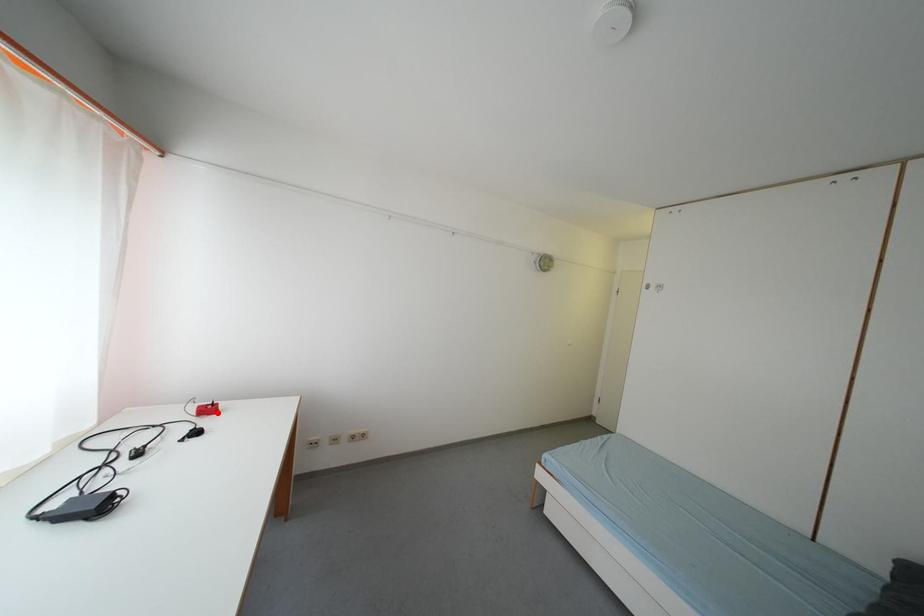
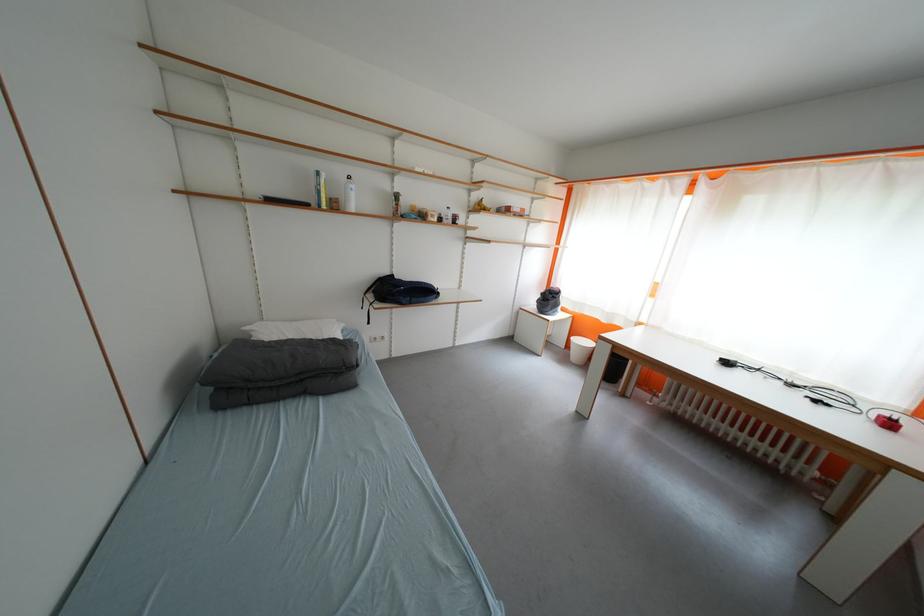
Question: I am providing you with two images of the same scene from different viewpoints. Image1 has a red point marked. In image2, the corresponding 3D location appears at what relative position? Reply with the corresponding letter.

Choices:
 (A) Closer
 (B) Farther

Answer: (A)